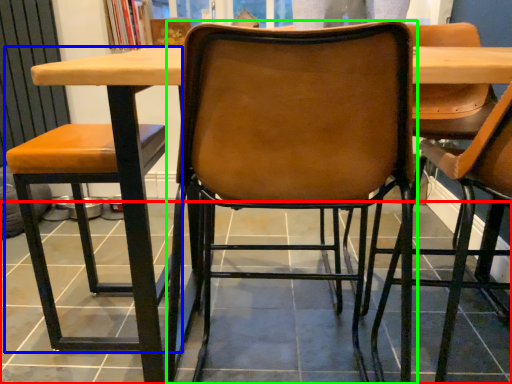
Question: Which object is positioned closest to tile (highlighted by a red box)? Select from chair (highlighted by a blue box) and chair (highlighted by a green box).

Choices:
 (A) chair
 (B) chair

Answer: (B)